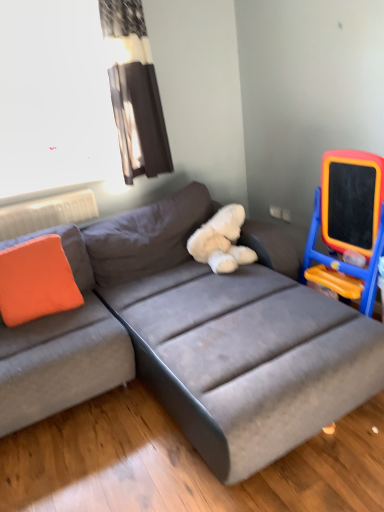
Question: Is there a large distance between transparent plastic window screen at upper left and gray fabric couch at center?

Choices:
 (A) yes
 (B) no

Answer: (A)

Question: Is transparent plastic window screen at upper left smaller than gray fabric couch at center?

Choices:
 (A) yes
 (B) no

Answer: (A)

Question: Considering the relative sizes of transparent plastic window screen at upper left and gray fabric couch at center in the image provided, is transparent plastic window screen at upper left bigger than gray fabric couch at center?

Choices:
 (A) no
 (B) yes

Answer: (A)

Question: Does transparent plastic window screen at upper left come behind gray fabric couch at center?

Choices:
 (A) yes
 (B) no

Answer: (A)

Question: Is the position of transparent plastic window screen at upper left less distant than that of gray fabric couch at center?

Choices:
 (A) yes
 (B) no

Answer: (B)

Question: Is transparent plastic window screen at upper left completely or partially outside of gray fabric couch at center?

Choices:
 (A) no
 (B) yes

Answer: (B)

Question: Can you confirm if black fabric curtain at upper left is bigger than transparent plastic window screen at upper left?

Choices:
 (A) yes
 (B) no

Answer: (B)

Question: Considering the relative sizes of black fabric curtain at upper left and transparent plastic window screen at upper left in the image provided, is black fabric curtain at upper left shorter than transparent plastic window screen at upper left?

Choices:
 (A) no
 (B) yes

Answer: (A)

Question: Is black fabric curtain at upper left not within transparent plastic window screen at upper left?

Choices:
 (A) no
 (B) yes

Answer: (B)

Question: Considering the relative sizes of black fabric curtain at upper left and transparent plastic window screen at upper left in the image provided, is black fabric curtain at upper left taller than transparent plastic window screen at upper left?

Choices:
 (A) yes
 (B) no

Answer: (A)

Question: Could you tell me if black fabric curtain at upper left is facing transparent plastic window screen at upper left?

Choices:
 (A) yes
 (B) no

Answer: (B)

Question: Is black fabric curtain at upper left positioned with its back to transparent plastic window screen at upper left?

Choices:
 (A) yes
 (B) no

Answer: (B)

Question: Is black fabric curtain at upper left facing towards gray fabric couch at center?

Choices:
 (A) no
 (B) yes

Answer: (A)